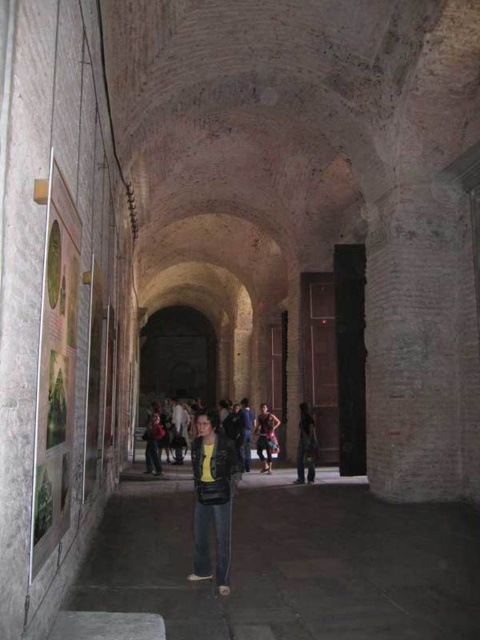
Does dark blue jeans at center have a greater height compared to multicolored fabric pants at center?

No.

From the picture: Measure the distance between dark blue jeans at center and camera.

dark blue jeans at center and camera are 31.81 meters apart from each other.

Who is more distant from viewer, (310,480) or (262,416)?

The point (262,416) is behind.

Where is `dark blue jeans at center`? The height and width of the screenshot is (640, 480). dark blue jeans at center is located at coordinates (305, 445).

Can you confirm if denim jeans at center is thinner than dark blue jeans at center?

In fact, denim jeans at center might be wider than dark blue jeans at center.

Does denim jeans at center come behind dark blue jeans at center?

No, denim jeans at center is in front of dark blue jeans at center.

Between point (305, 600) and point (301, 412), which one is positioned behind?

The point (301, 412) is behind.

Locate an element on the screen. The width and height of the screenshot is (480, 640). denim jeans at center is located at coordinates (290, 563).

Can you confirm if leather jacket at center is thinner than dark blue jeans at center?

No, leather jacket at center is not thinner than dark blue jeans at center.

Can you confirm if leather jacket at center is taller than dark blue jeans at center?

Indeed, leather jacket at center has a greater height compared to dark blue jeans at center.

Does point (193, 461) lie in front of point (300, 456)?

Yes, it is in front of point (300, 456).

This screenshot has width=480, height=640. I want to click on leather jacket at center, so click(212, 499).